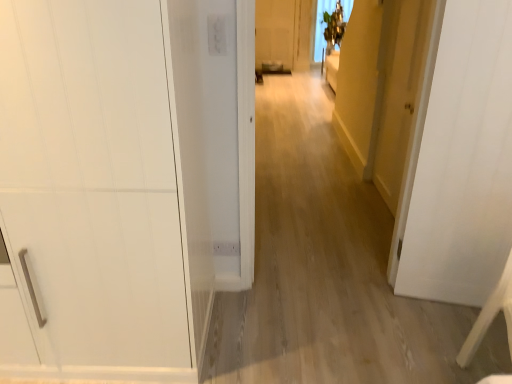
You are a GUI agent. You are given a task and a screenshot of the screen. Output one action in this format:
    pyautogui.click(x=<x>, y=<y>)
    Task: Click on the free spot in front of white matte door at center, marked as the second door in a left-to-right arrangement
    The height and width of the screenshot is (384, 512).
    Given the screenshot: What is the action you would take?
    pyautogui.click(x=430, y=336)